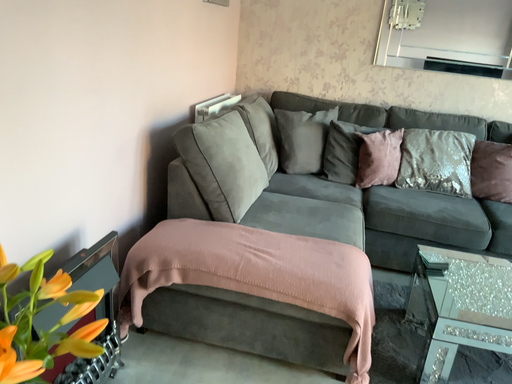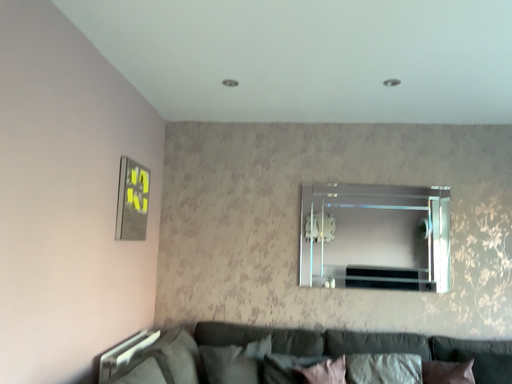
Question: How did the camera likely rotate when shooting the video?

Choices:
 (A) rotated right
 (B) rotated left

Answer: (A)